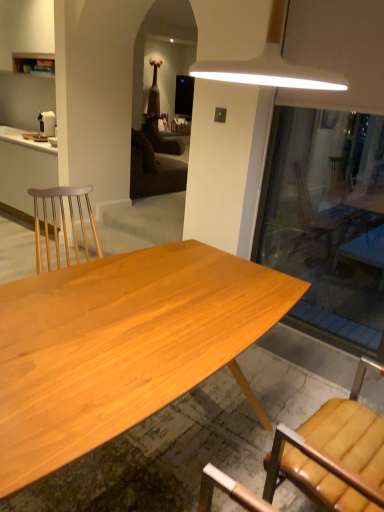
Question: Is natural wood desk at center next to white plastic coffee maker at left and touching it?

Choices:
 (A) yes
 (B) no

Answer: (B)

Question: Is natural wood desk at center thinner than white plastic coffee maker at left?

Choices:
 (A) no
 (B) yes

Answer: (A)

Question: Is natural wood desk at center wider than white plastic coffee maker at left?

Choices:
 (A) yes
 (B) no

Answer: (A)

Question: Is natural wood desk at center not near white plastic coffee maker at left?

Choices:
 (A) no
 (B) yes

Answer: (B)

Question: Is natural wood desk at center at the left side of white plastic coffee maker at left?

Choices:
 (A) no
 (B) yes

Answer: (A)

Question: Relative to white plastic coffee maker at left, is natural wood desk at center in front or behind?

Choices:
 (A) front
 (B) behind

Answer: (A)

Question: From the image's perspective, is natural wood desk at center located above or below white plastic coffee maker at left?

Choices:
 (A) above
 (B) below

Answer: (B)

Question: Considering the relative positions of natural wood desk at center and white plastic coffee maker at left in the image provided, is natural wood desk at center to the left or to the right of white plastic coffee maker at left?

Choices:
 (A) right
 (B) left

Answer: (A)

Question: In terms of width, does natural wood desk at center look wider or thinner when compared to white plastic coffee maker at left?

Choices:
 (A) thin
 (B) wide

Answer: (B)

Question: Considering the positions of brown leather chair at lower right and matte white cabinet at left in the image, is brown leather chair at lower right taller or shorter than matte white cabinet at left?

Choices:
 (A) tall
 (B) short

Answer: (B)

Question: Considering the positions of brown leather chair at lower right and matte white cabinet at left in the image, is brown leather chair at lower right bigger or smaller than matte white cabinet at left?

Choices:
 (A) big
 (B) small

Answer: (B)

Question: Is brown leather chair at lower right in front of or behind matte white cabinet at left in the image?

Choices:
 (A) front
 (B) behind

Answer: (A)

Question: Considering the positions of point (367, 360) and point (6, 202), is point (367, 360) closer or farther from the camera than point (6, 202)?

Choices:
 (A) farther
 (B) closer

Answer: (B)

Question: Considering the positions of matte white cabinet at left and natural wood desk at center in the image, is matte white cabinet at left bigger or smaller than natural wood desk at center?

Choices:
 (A) small
 (B) big

Answer: (B)

Question: Considering the positions of point (44, 165) and point (0, 454), is point (44, 165) closer or farther from the camera than point (0, 454)?

Choices:
 (A) closer
 (B) farther

Answer: (B)